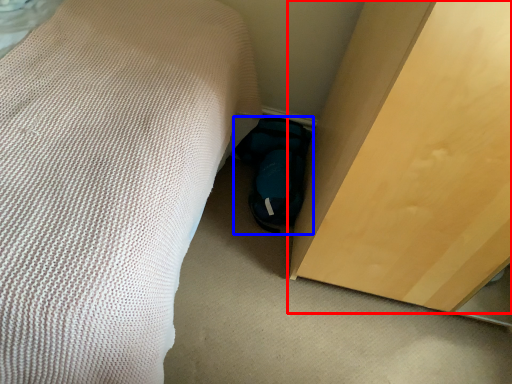
Question: Which object is further to the camera taking this photo, furniture (highlighted by a red box) or footwear (highlighted by a blue box)?

Choices:
 (A) furniture
 (B) footwear

Answer: (B)